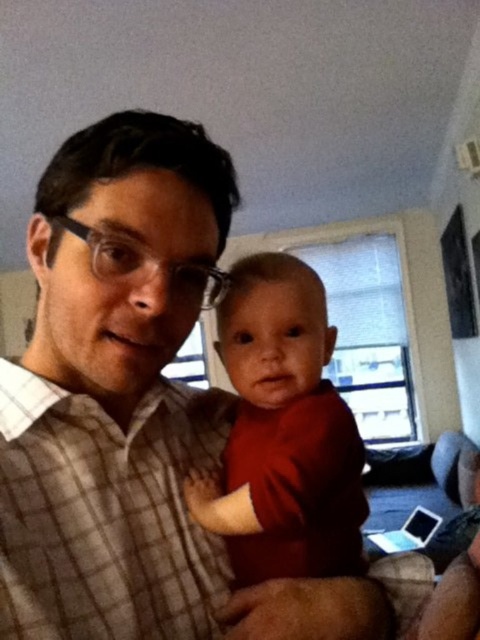
Consider the image. What is the position of the plaid shirt at center in the image?

The plaid shirt at center is located at point 0.641 on the x axis and 0.275 on the y axis.

You are standing in the room and want to place a small plant between the two points, point (162, 464) and point (248, 268). Which point should the plant be closer to if you want it to be nearer to the viewer?

The plant should be placed closer to point (162, 464) because it is closer to the viewer than point (248, 268).

You are a photographer trying to focus on the plaid shirt at center and the matte red shirt at center. Which one is closer to the camera?

The plaid shirt at center is in front of the matte red shirt at center, so it is closer to the camera.